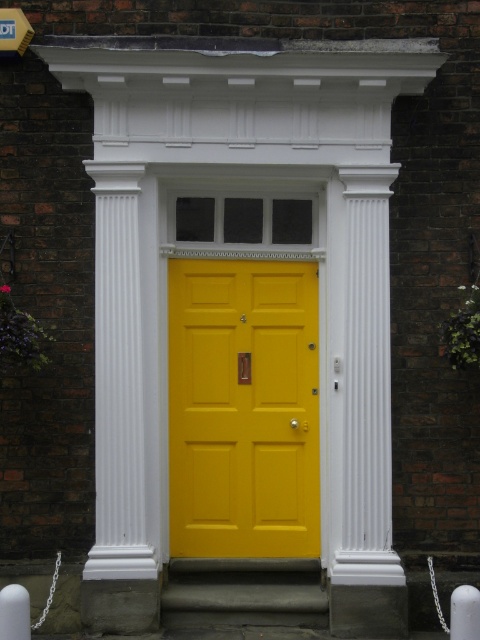
Can you confirm if concrete at center is taller than metallic yellow street sign at upper left?

Yes.

This screenshot has width=480, height=640. I want to click on concrete at center, so click(243, 593).

Is matte yellow door at center below metallic yellow street sign at upper left?

Correct, matte yellow door at center is located below metallic yellow street sign at upper left.

Looking at this image, measure the distance between point (259, 429) and camera.

A distance of 7.71 meters exists between point (259, 429) and camera.

Locate an element on the screen. The width and height of the screenshot is (480, 640). matte yellow door at center is located at coordinates (242, 408).

Does matte yellow door at center lie in front of concrete at center?

No.

Which is in front, point (213, 406) or point (210, 589)?

Point (210, 589) is more forward.

Locate an element on the screen. This screenshot has width=480, height=640. matte yellow door at center is located at coordinates (242, 408).